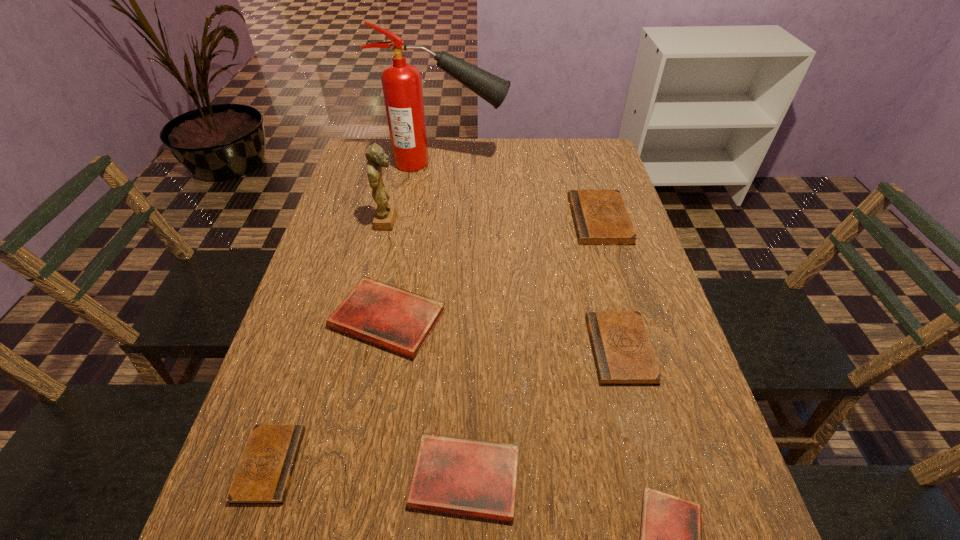
Choose which red diary is the nearest neighbor to the second smallest red diary. Please provide its 2D coordinates. Your answer should be formatted as a tuple, i.e. [(x, y)], where the tuple contains the x and y coordinates of a point satisfying the conditions above.

[(670, 530)]

The height and width of the screenshot is (540, 960). I want to click on free location that satisfies the following two spatial constraints: 1. on the back side of the second biggest red diary; 2. at the nozzle of the fire extinguisher, so click(472, 163).

Identify the location of vacant area that satisfies the following two spatial constraints: 1. on the spine side of the nearest brown diary; 2. on the right side of the second biggest red diary. (265, 478).